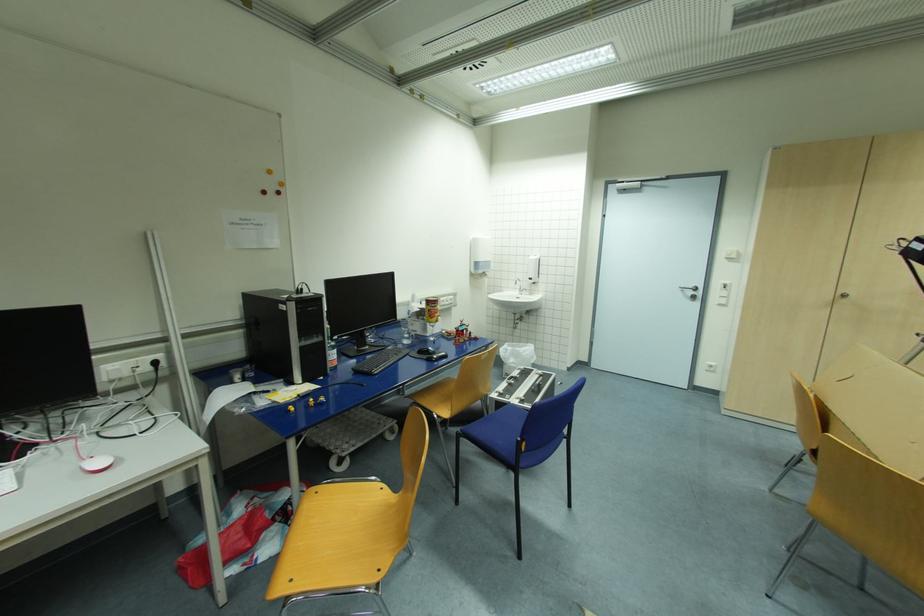
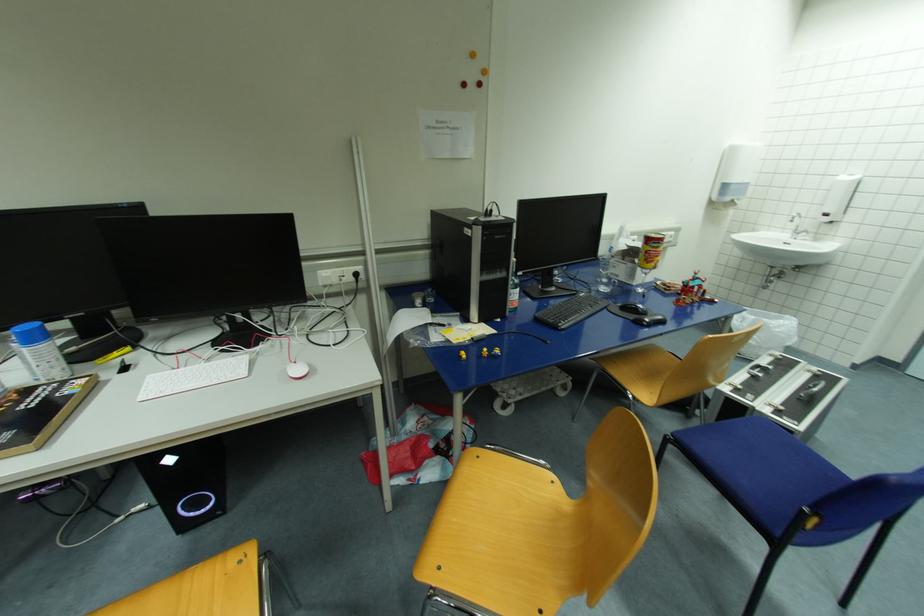
Where in the second image is the point corresponding to point 520,397 from the first image?

(772, 402)